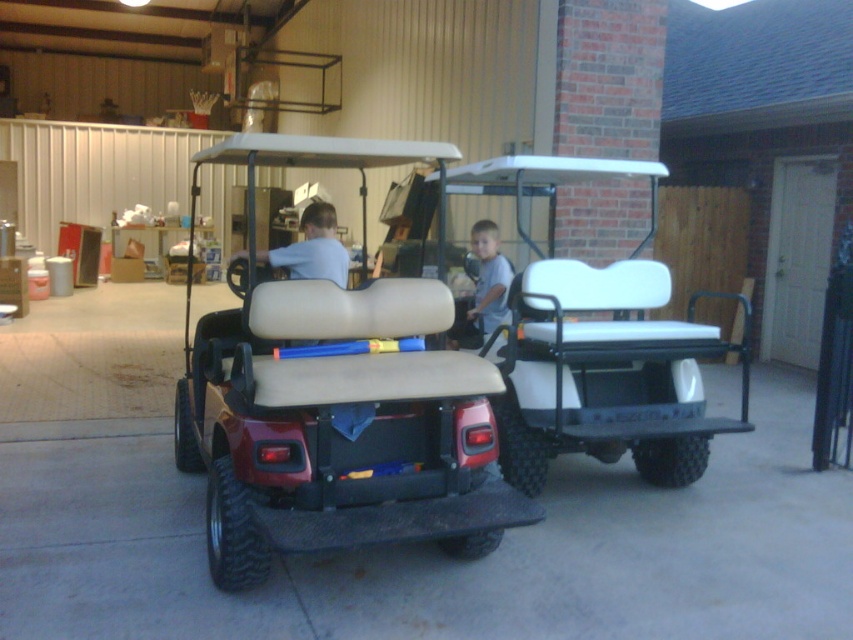
Question: Where is matte white shirt at center located in relation to gray matte shirt at center in the image?

Choices:
 (A) right
 (B) left

Answer: (B)

Question: Which of the following is the farthest from the observer?

Choices:
 (A) (320, 400)
 (B) (483, 236)

Answer: (B)

Question: Which point is farther to the camera?

Choices:
 (A) white matte golf cart at center
 (B) beige leather golf cart at center
 (C) gray matte shirt at center
 (D) matte white shirt at center

Answer: (C)

Question: Which of these objects is positioned closest to the gray matte shirt at center?

Choices:
 (A) beige leather golf cart at center
 (B) white matte golf cart at center
 (C) matte white shirt at center

Answer: (B)

Question: Can you confirm if white matte golf cart at center is positioned to the right of gray matte shirt at center?

Choices:
 (A) yes
 (B) no

Answer: (A)

Question: Does white matte golf cart at center come behind matte white shirt at center?

Choices:
 (A) yes
 (B) no

Answer: (B)